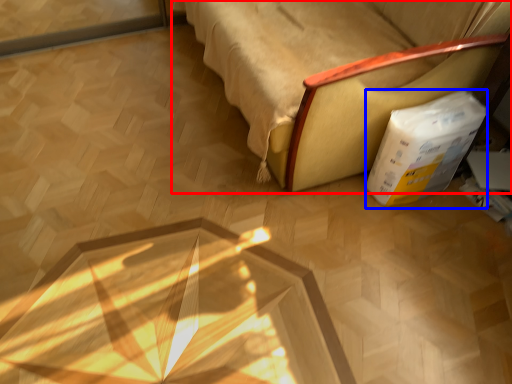
Question: Which object is closer to the camera taking this photo, furniture (highlighted by a red box) or cardboard box (highlighted by a blue box)?

Choices:
 (A) furniture
 (B) cardboard box

Answer: (A)